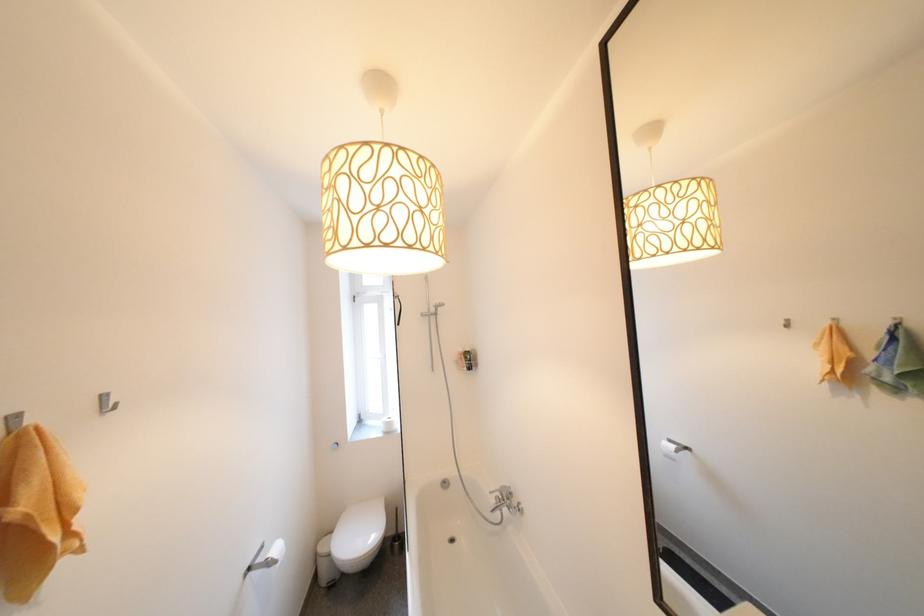
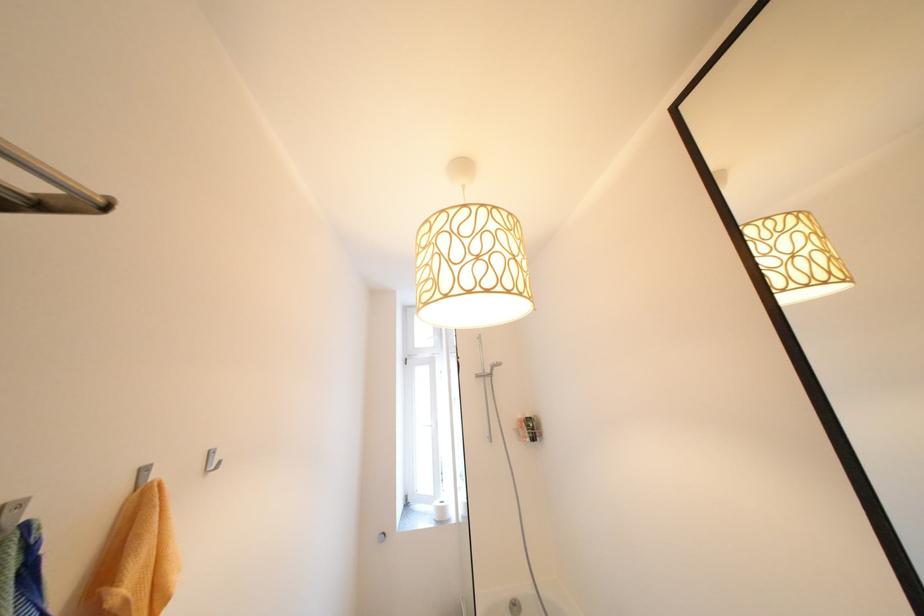
Locate, in the second image, the point that corresponds to the point at 434,312 in the first image.

(490, 371)